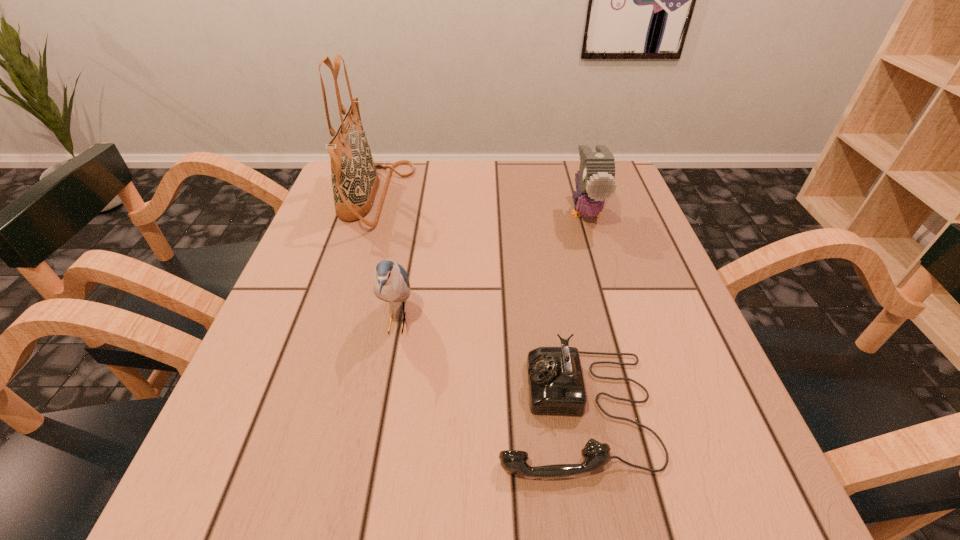
This screenshot has width=960, height=540. I want to click on object at the near right corner, so pos(556,386).

The height and width of the screenshot is (540, 960). Identify the location of vacant space at the far edge of the desktop. (416, 164).

Find the location of a particular element. vacant area at the near edge of the desktop is located at coordinates (605, 510).

At what (x,y) coordinates should I click in order to perform the action: click on free location at the left edge. Please return your answer as a coordinate pair (x, y). This screenshot has width=960, height=540. Looking at the image, I should click on (280, 366).

At what (x,y) coordinates should I click in order to perform the action: click on free space at the right edge of the desktop. Please return your answer as a coordinate pair (x, y). Looking at the image, I should click on (660, 298).

The width and height of the screenshot is (960, 540). In order to click on vacant space at the near left corner of the desktop in this screenshot , I will do `click(277, 532)`.

Where is `free space between the farther bird and the nearer bird`? Image resolution: width=960 pixels, height=540 pixels. free space between the farther bird and the nearer bird is located at coordinates (492, 267).

Locate an element on the screen. The image size is (960, 540). free space between the nearest object and the farther bird is located at coordinates (580, 311).

Locate an element on the screen. The height and width of the screenshot is (540, 960). vacant area between the tallest object and the right bird is located at coordinates (480, 205).

Where is `vacant area that lies between the nearest object and the third farthest object`? vacant area that lies between the nearest object and the third farthest object is located at coordinates (486, 366).